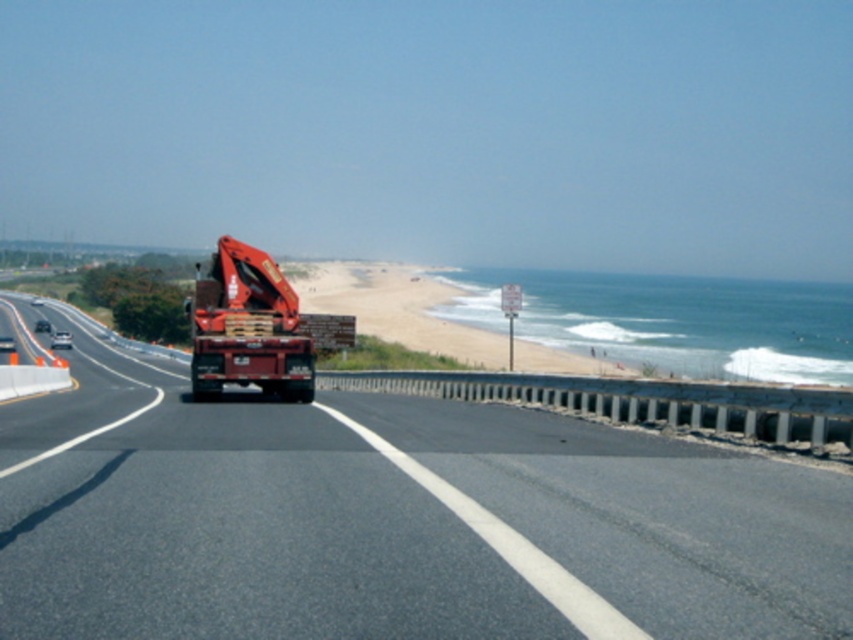
You are driving a large truck and need to turn around on the smooth asphalt highway at center. Considering the size of the highway and the matte red trailer truck at center, do you think there is enough space to make a U turn?

The smooth asphalt highway at center is bigger than the matte red trailer truck at center, so there is enough space to make a U turn.

You are a delivery driver approaching the smooth asphalt highway at center and the matte red trailer truck at center. Which object is closer to the road surface?

The smooth asphalt highway at center is positioned under matte red trailer truck at center, so the highway is closer to the road surface than the truck.